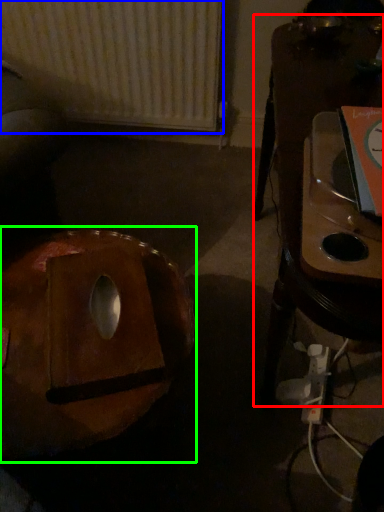
Question: Considering the real-world distances, which object is farthest from furniture (highlighted by a red box)? radiator (highlighted by a blue box) or bean bag chair (highlighted by a green box)?

Choices:
 (A) radiator
 (B) bean bag chair

Answer: (A)